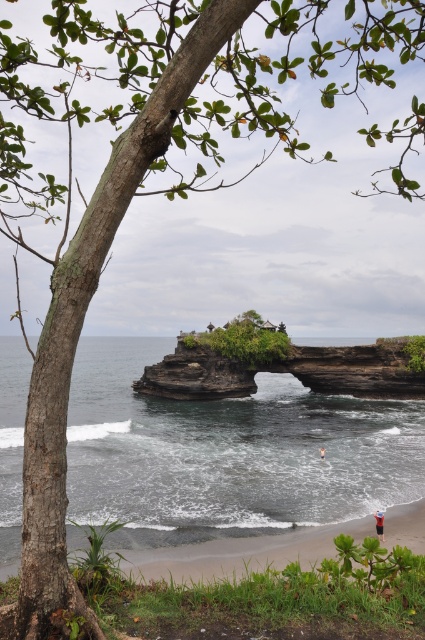
You are a photographer planning to capture the dark brown stone arch at center and the dark gray water at center in a single shot. Based on their relative heights, which object should you focus on first to ensure both are in frame?

The dark gray water at center is not as tall as the dark brown stone arch at center, so you should focus on the taller dark brown stone arch at center first to ensure both are in frame.

Based on the coordinates provided, can you identify which object in the scene corresponds to the point labeled as point (x=227, y=456)?

The point (x=227, y=456) corresponds to the dark gray water at center.

You are a photographer planning to capture the dark gray water at center and the dark brown stone arch at center in a single shot. Based on their widths, which object should you position closer to the center of the frame to ensure both are fully visible?

The dark gray water at center is wider than the dark brown stone arch at center. Position the dark gray water at center closer to the center of the frame since its greater width requires more space to be fully captured, allowing the narrower dark brown stone arch at center to fit alongside without cropping.